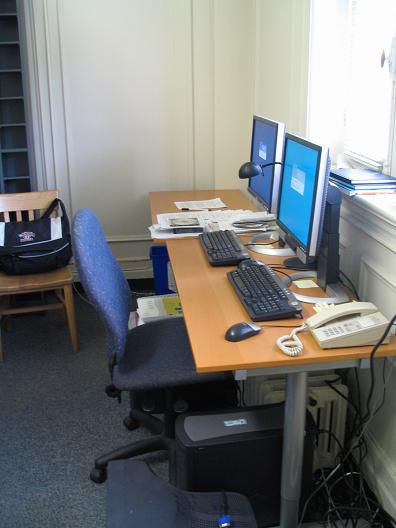
The height and width of the screenshot is (528, 396). In order to click on mouse in this screenshot , I will do `click(252, 259)`, `click(241, 329)`.